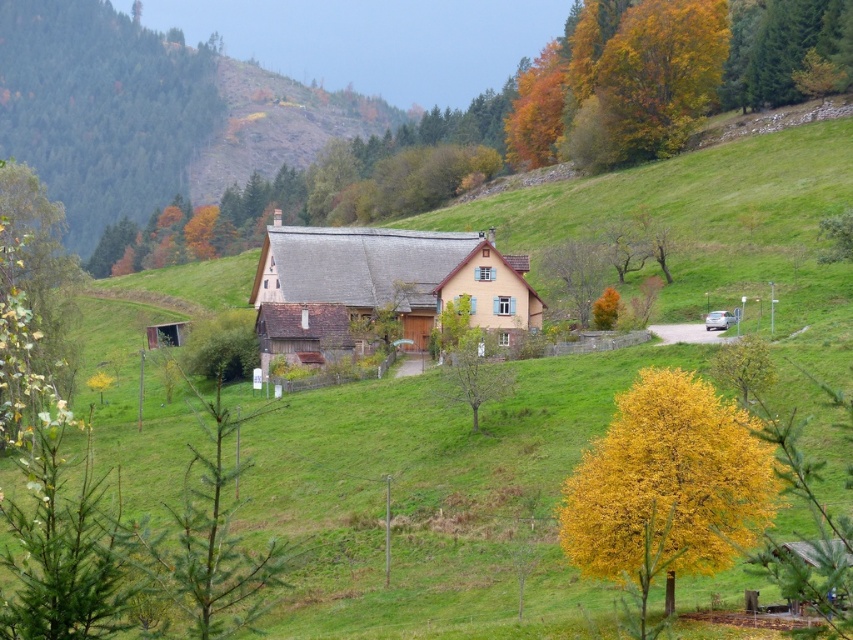
You are planning to plant a new tree in your backyard and want to choose between the yellow leafy tree at lower right and the bare branches at center based on their sizes. Which tree should you choose if you want a wider tree?

The yellow leafy tree at lower right is wider than the bare branches at center, so you should choose the yellow leafy tree at lower right for a wider tree.

You are standing on the dirt path leading to the house and see the yellow leafy tree at lower right and the bare branches at center. Which object is closer to you?

The yellow leafy tree at lower right is closer to you because it is in front of the bare branches at center.